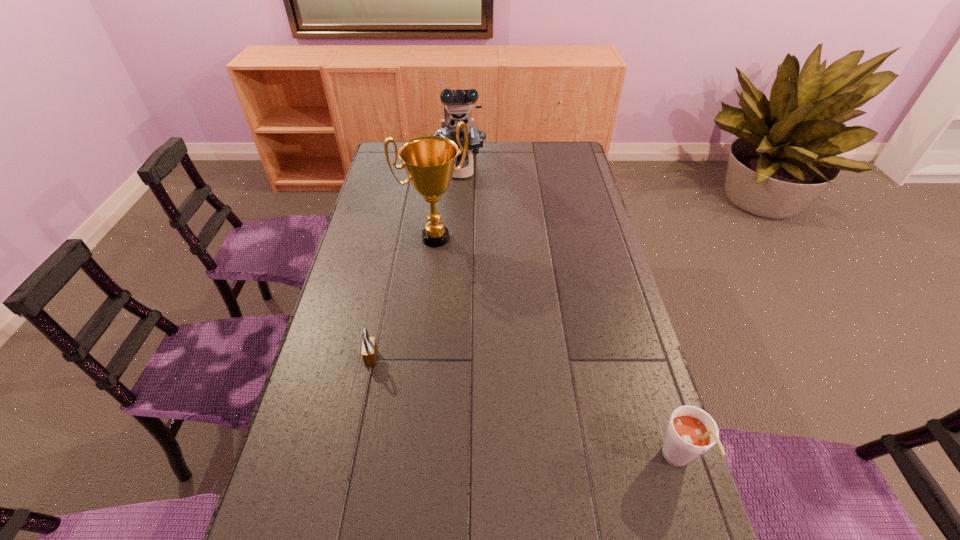
You are a GUI agent. You are given a task and a screenshot of the screen. Output one action in this format:
    pyautogui.click(x=<x>, y=<y>)
    Task: Click on the free space at the far right corner
    This screenshot has height=540, width=960.
    Given the screenshot: What is the action you would take?
    pyautogui.click(x=550, y=168)

Where is `free space at the near right corner of the desktop`? The height and width of the screenshot is (540, 960). free space at the near right corner of the desktop is located at coordinates (657, 503).

Find the location of a particular element. empty space that is in between the microscope and the third nearest object is located at coordinates (447, 204).

The width and height of the screenshot is (960, 540). I want to click on vacant region between the padlock and the farthest object, so click(415, 264).

This screenshot has height=540, width=960. What are the coordinates of `unoccupied position between the second farthest object and the farthest object` in the screenshot? It's located at (447, 204).

The height and width of the screenshot is (540, 960). Identify the location of free spot between the second shortest object and the award. (557, 349).

Find the location of a particular element. Image resolution: width=960 pixels, height=540 pixels. empty space that is in between the second nearest object and the nearest object is located at coordinates (524, 409).

Where is `vacant space that's between the farthest object and the second farthest object`? This screenshot has width=960, height=540. vacant space that's between the farthest object and the second farthest object is located at coordinates (447, 204).

Identify the location of unoccupied position between the root beer and the microscope. The width and height of the screenshot is (960, 540). (568, 315).

Find the location of a particular element. This screenshot has height=540, width=960. unoccupied area between the second farthest object and the microscope is located at coordinates (447, 204).